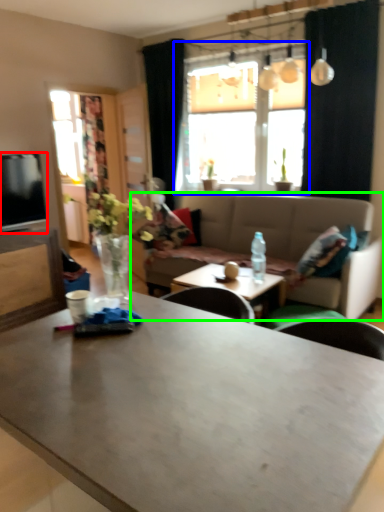
Question: Which is farther away from television (highlighted by a red box)? window (highlighted by a blue box) or studio couch (highlighted by a green box)?

Choices:
 (A) window
 (B) studio couch

Answer: (A)